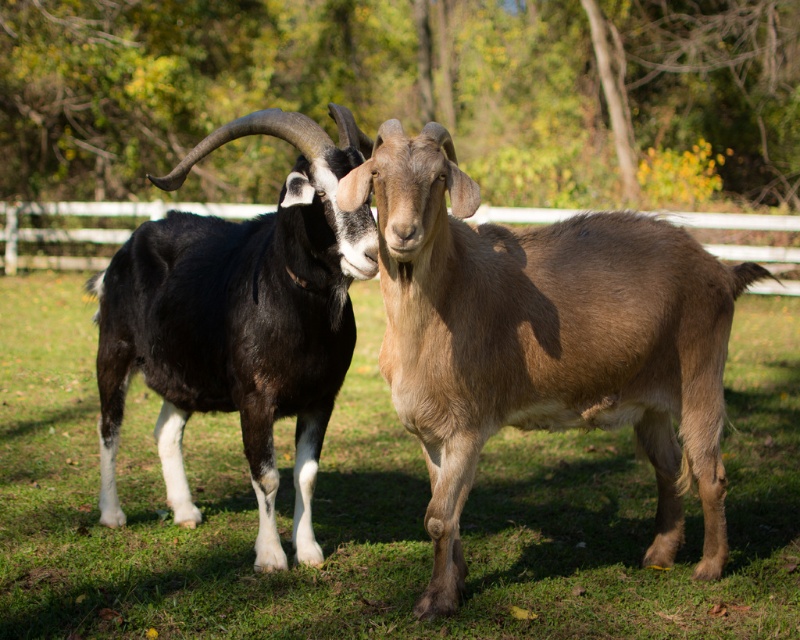
Question: Is green grass at center bigger than brown woolen goat at center?

Choices:
 (A) yes
 (B) no

Answer: (A)

Question: Does brown woolen goat at center have a smaller size compared to shiny black goat at left?

Choices:
 (A) no
 (B) yes

Answer: (B)

Question: Which is nearer to the brown woolen goat at center?

Choices:
 (A) green grass at center
 (B) shiny black goat at left

Answer: (B)

Question: Based on their relative distances, which object is nearer to the green grass at center?

Choices:
 (A) shiny black goat at left
 (B) brown woolen goat at center

Answer: (B)

Question: Is green grass at center bigger than shiny black goat at left?

Choices:
 (A) yes
 (B) no

Answer: (A)

Question: Estimate the real-world distances between objects in this image. Which object is closer to the green grass at center?

Choices:
 (A) brown woolen goat at center
 (B) shiny black goat at left

Answer: (A)